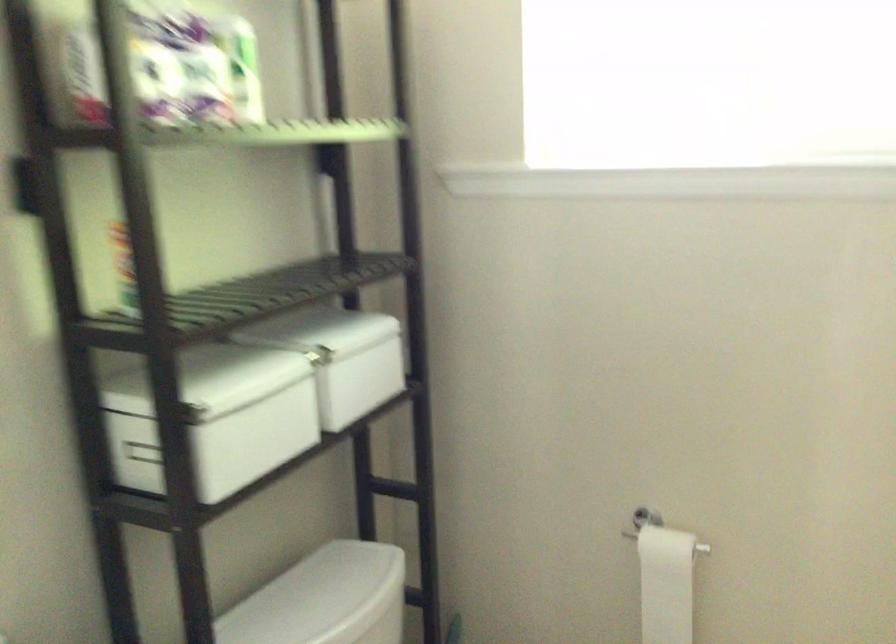
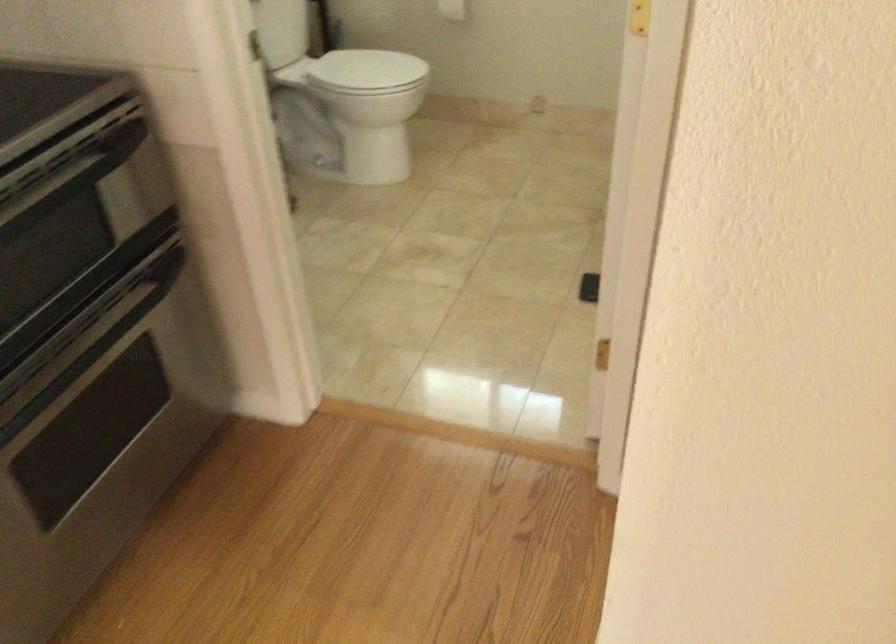
Question: In a continuous first-person perspective shot, in which direction is the camera moving?

Choices:
 (A) Left
 (B) Right
 (C) Forward
 (D) Backward

Answer: (D)